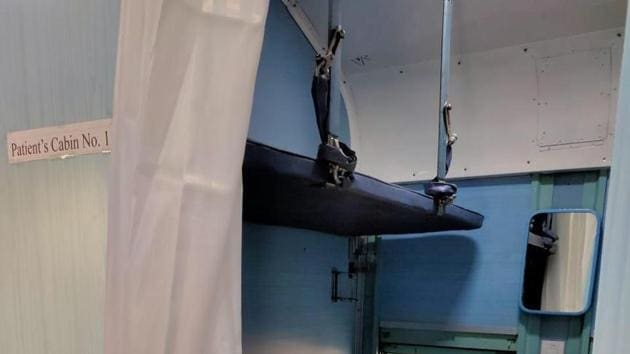
Identify the location of white ceiling. (513, 84).